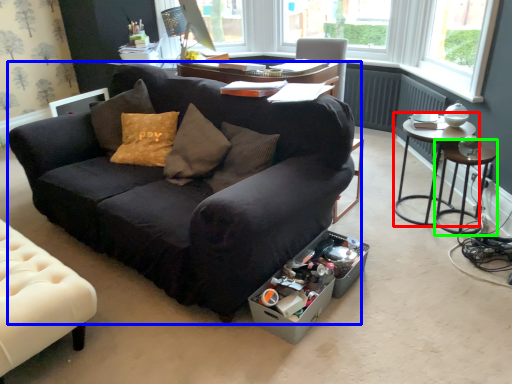
Question: Which object is positioned closest to table (highlighted by a red box)? Select from studio couch (highlighted by a blue box) and side table (highlighted by a green box).

Choices:
 (A) studio couch
 (B) side table

Answer: (B)